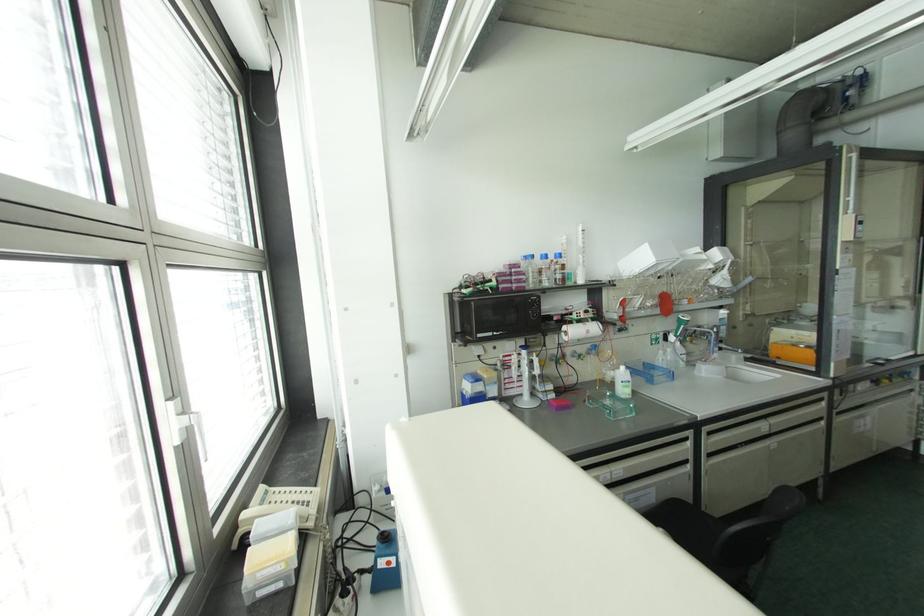
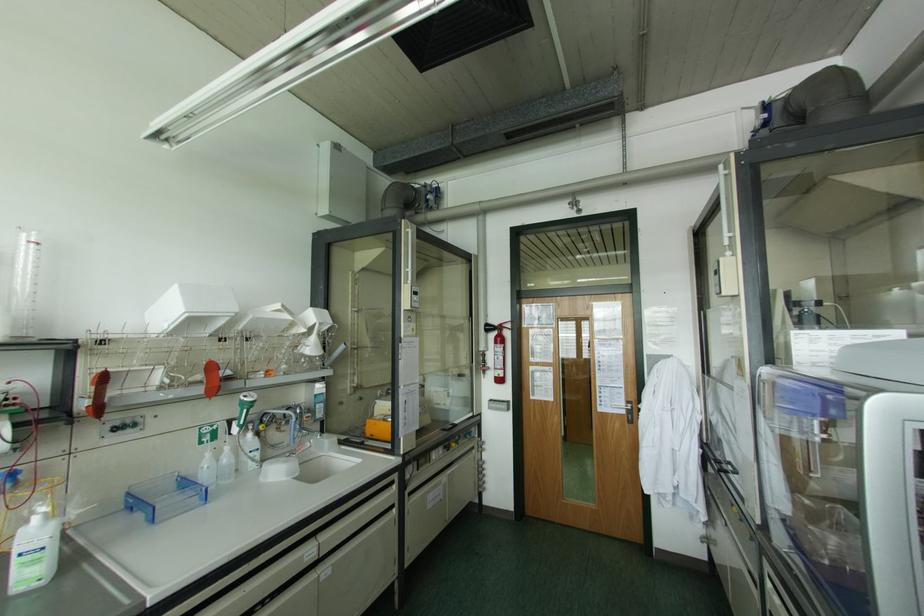
In the second image, find the point that corresponds to (762,426) in the first image.

(308, 552)